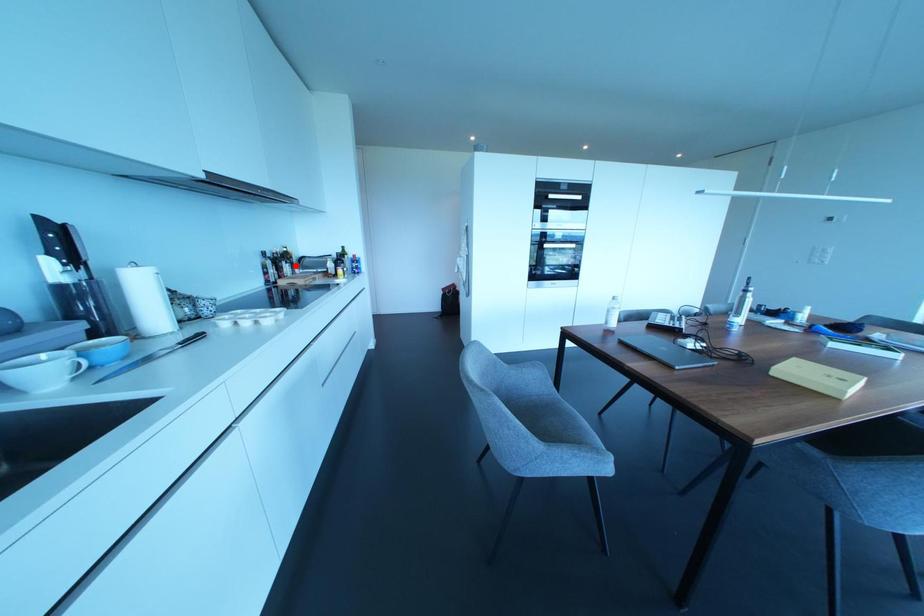
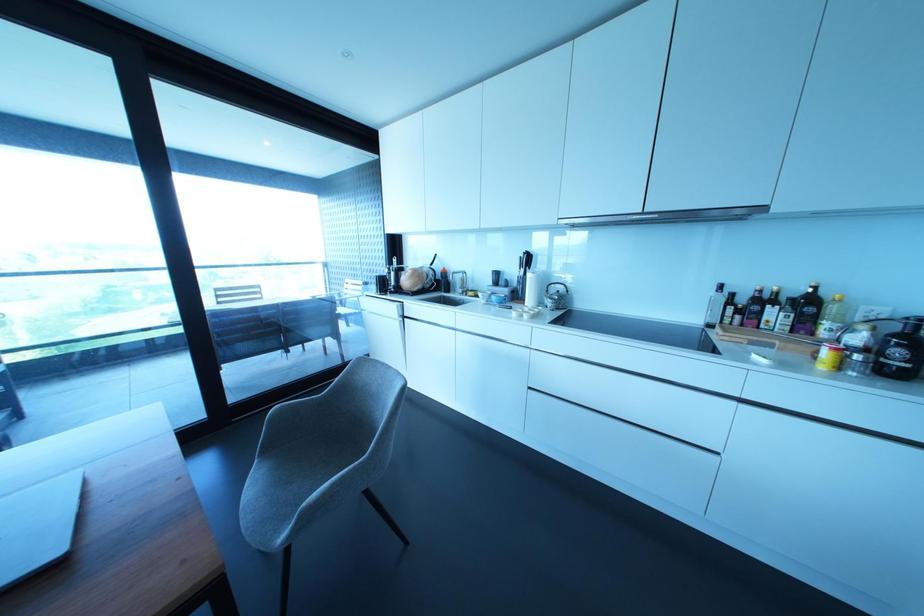
Question: I am providing you with two images of the same scene from different viewpoints. In image1, a red point is highlighted. Considering the same 3D point in image2, which of the following is correct?

Choices:
 (A) It is closer
 (B) It is farther

Answer: (B)